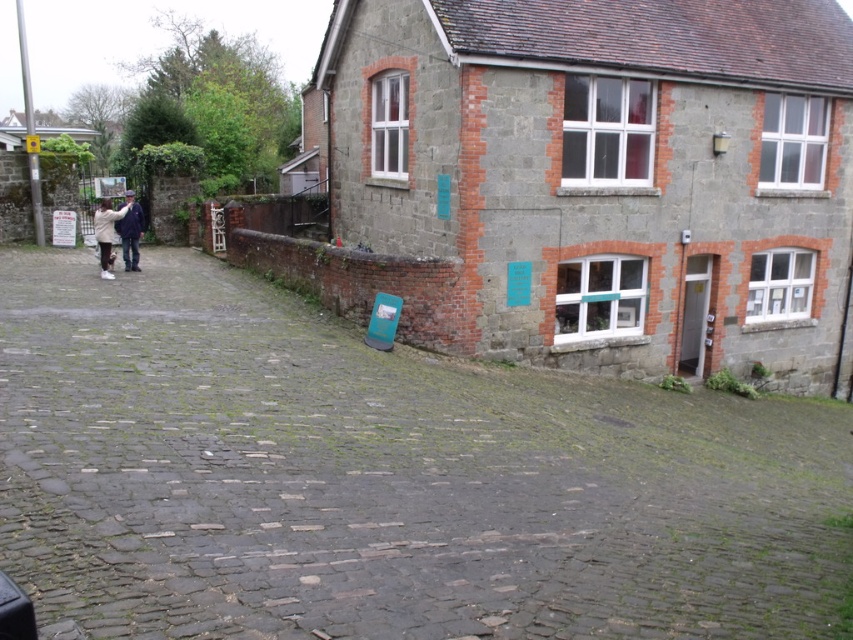
Does brown cobblestone alley at center have a greater width compared to blue denim jacket at left?

Correct, the width of brown cobblestone alley at center exceeds that of blue denim jacket at left.

Is point (341, 493) positioned before point (126, 202)?

Yes, it is.

Between point (665, 547) and point (138, 246), which one is positioned behind?

Positioned behind is point (138, 246).

Where is `brown cobblestone alley at center`? brown cobblestone alley at center is located at coordinates (383, 480).

Does point (601, 440) lie in front of point (119, 212)?

Yes.

Does brown cobblestone alley at center come behind light brown leather jacket at left?

No, it is in front of light brown leather jacket at left.

Where is `brown cobblestone alley at center`? This screenshot has width=853, height=640. brown cobblestone alley at center is located at coordinates (383, 480).

Where is `brown cobblestone alley at center`? The height and width of the screenshot is (640, 853). brown cobblestone alley at center is located at coordinates pos(383,480).

Image resolution: width=853 pixels, height=640 pixels. What do you see at coordinates (106, 230) in the screenshot? I see `light brown leather jacket at left` at bounding box center [106, 230].

Does light brown leather jacket at left appear on the left side of blue denim jacket at left?

Yes, light brown leather jacket at left is to the left of blue denim jacket at left.

Between point (113, 214) and point (131, 257), which one is positioned in front?

Point (113, 214) is in front.

What are the coordinates of `light brown leather jacket at left` in the screenshot? It's located at (106, 230).